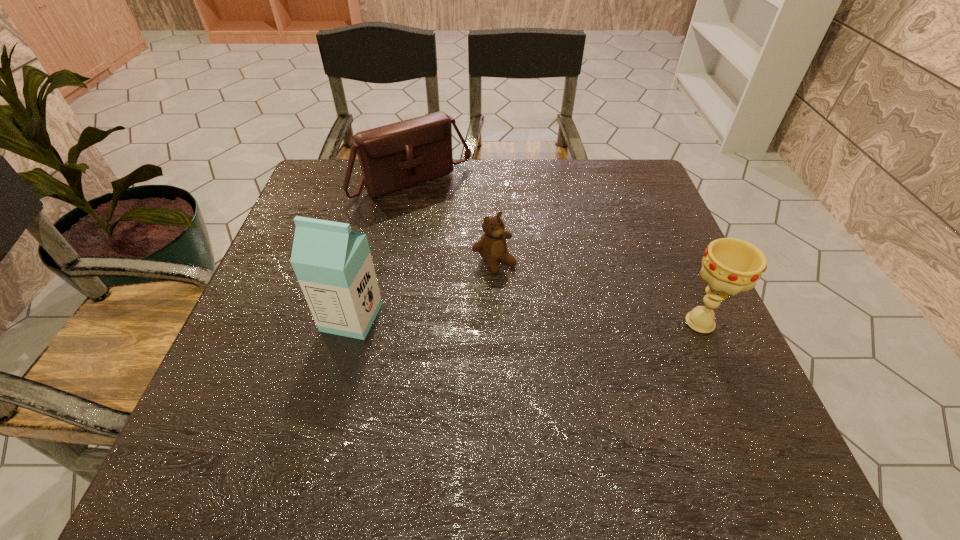
Find the location of `free space on the desktop that is between the milk carton and the chalice and is positioned on the front flap of the farthest object`. free space on the desktop that is between the milk carton and the chalice and is positioned on the front flap of the farthest object is located at coordinates (540, 320).

This screenshot has width=960, height=540. What are the coordinates of `free space on the desktop that is between the milk carton and the chalice and is positioned at the face of the shortest object` in the screenshot? It's located at (546, 320).